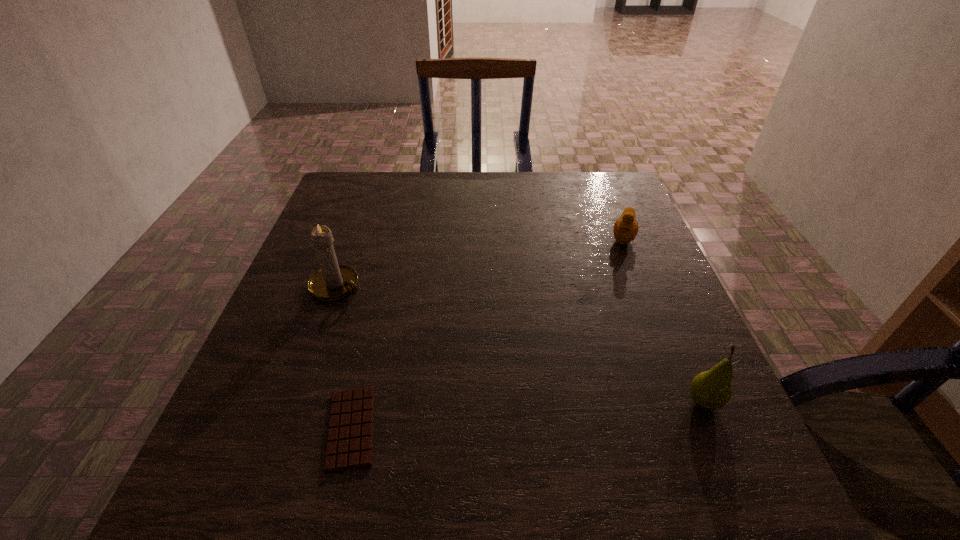
Locate an element on the screen. candy bar is located at coordinates (349, 445).

Find the location of `the shortest object`. the shortest object is located at coordinates (349, 445).

You are a GUI agent. You are given a task and a screenshot of the screen. Output one action in this format:
    pyautogui.click(x=<x>, y=<y>)
    Task: Click on the second tallest object
    
    Given the screenshot: What is the action you would take?
    pyautogui.click(x=711, y=390)

The height and width of the screenshot is (540, 960). Find the location of `the second shortest object`. the second shortest object is located at coordinates (625, 230).

You are a GUI agent. You are given a task and a screenshot of the screen. Output one action in this format:
    pyautogui.click(x=<x>, y=<y>)
    Task: Click on the duckling
    
    Given the screenshot: What is the action you would take?
    pyautogui.click(x=625, y=230)

Identify the location of the third nearest object. Image resolution: width=960 pixels, height=540 pixels. (332, 282).

In order to click on the leftmost object in this screenshot , I will do `click(332, 282)`.

Identify the location of vacant space situated on the back of the second object from left to right. Image resolution: width=960 pixels, height=540 pixels. (380, 303).

This screenshot has height=540, width=960. I want to click on vacant region located on the left of the pear, so click(x=558, y=402).

Identify the location of vacant region located 0.120m on the face of the farthest object. coord(616,279).